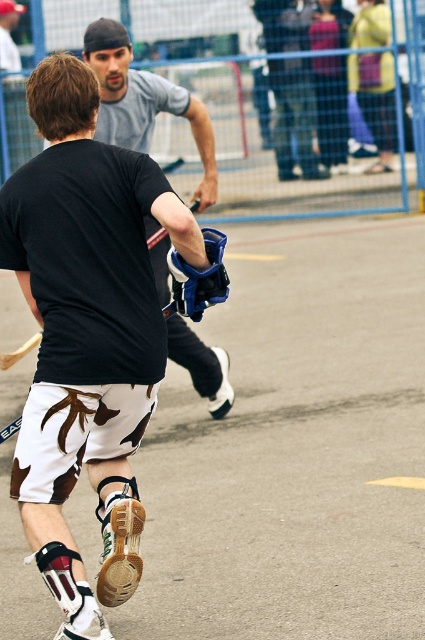
Who is shorter, white leather shorts at center or matte gray shirt at upper center?

matte gray shirt at upper center is shorter.

Does point (19, 192) come in front of point (110, 35)?

Yes, it is.

I want to click on white leather shorts at center, so click(87, 332).